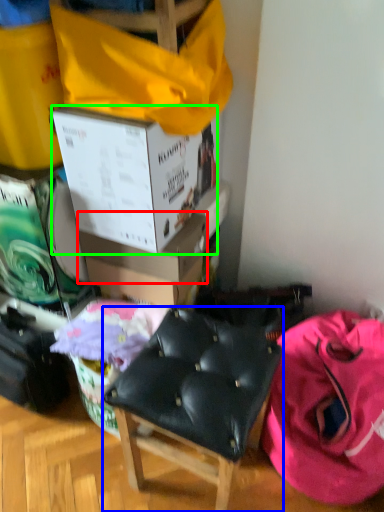
Question: Which object is the farthest from box (highlighted by a red box)? Choose among these: chair (highlighted by a blue box) or box (highlighted by a green box).

Choices:
 (A) chair
 (B) box

Answer: (A)